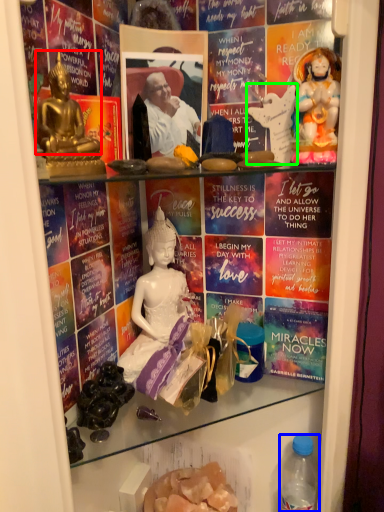
Question: Based on their relative distances, which object is farther from person (highlighted by a red box)? Choose from bottle (highlighted by a blue box) and sculpture (highlighted by a green box).

Choices:
 (A) bottle
 (B) sculpture

Answer: (A)